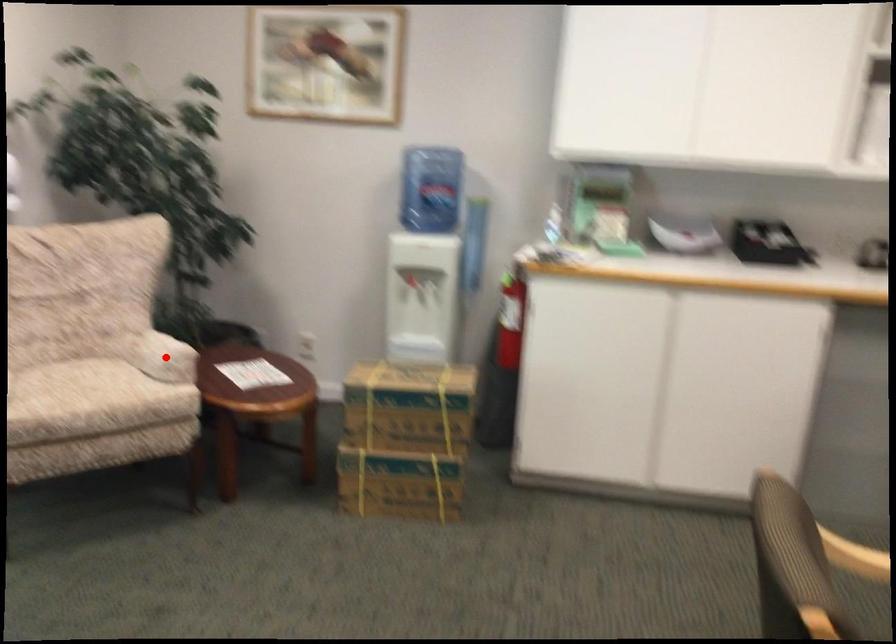
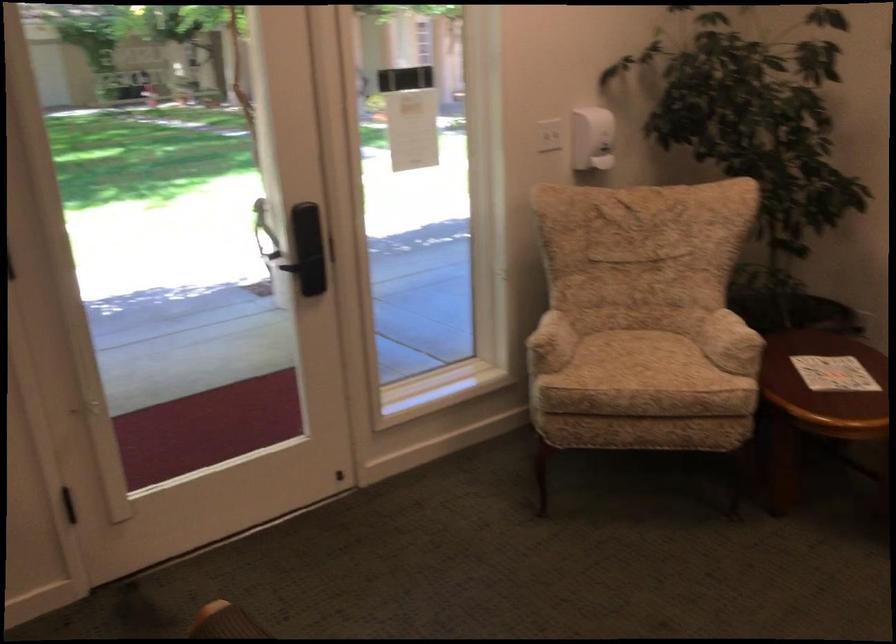
Locate, in the second image, the point that corresponds to the highlighted location in the first image.

(728, 343)